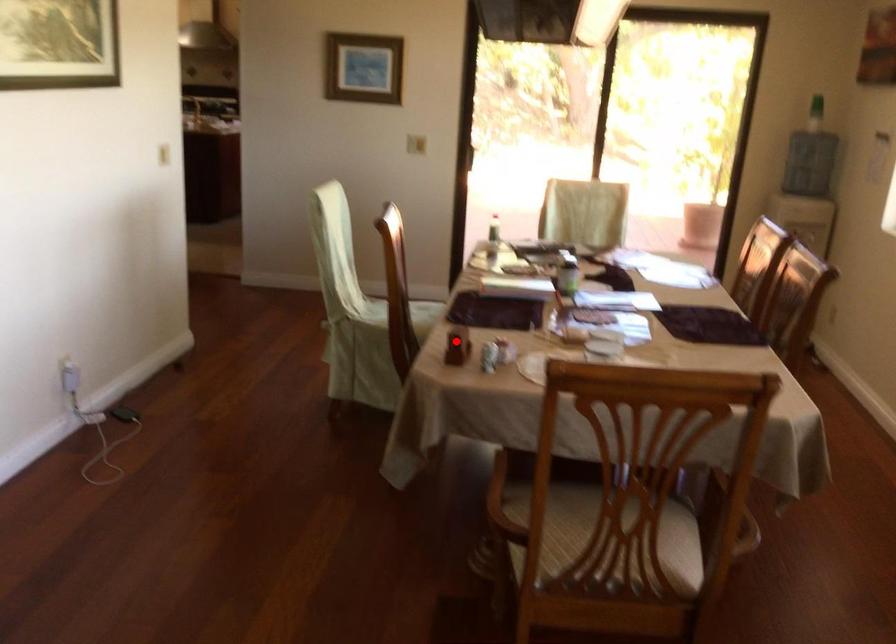
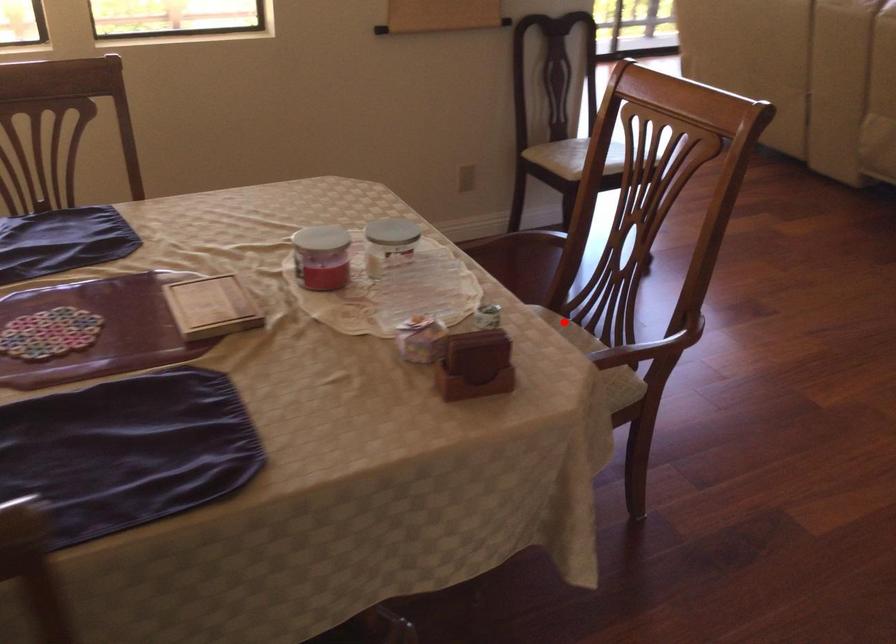
I am providing you with two images of the same scene from different viewpoints. A red point is marked on the first image and another point is marked on the second image. Do the highlighted points in image1 and image2 indicate the same real-world spot?

No